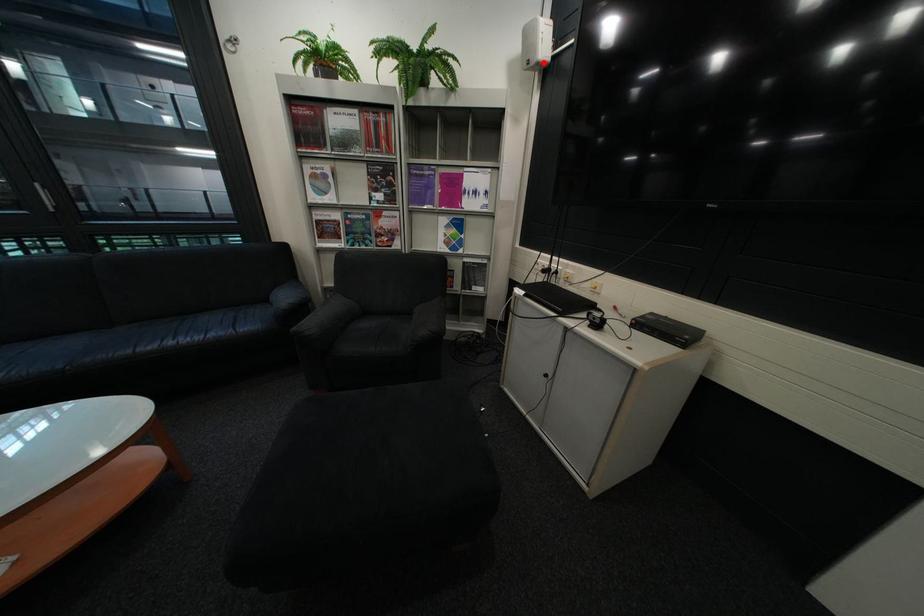
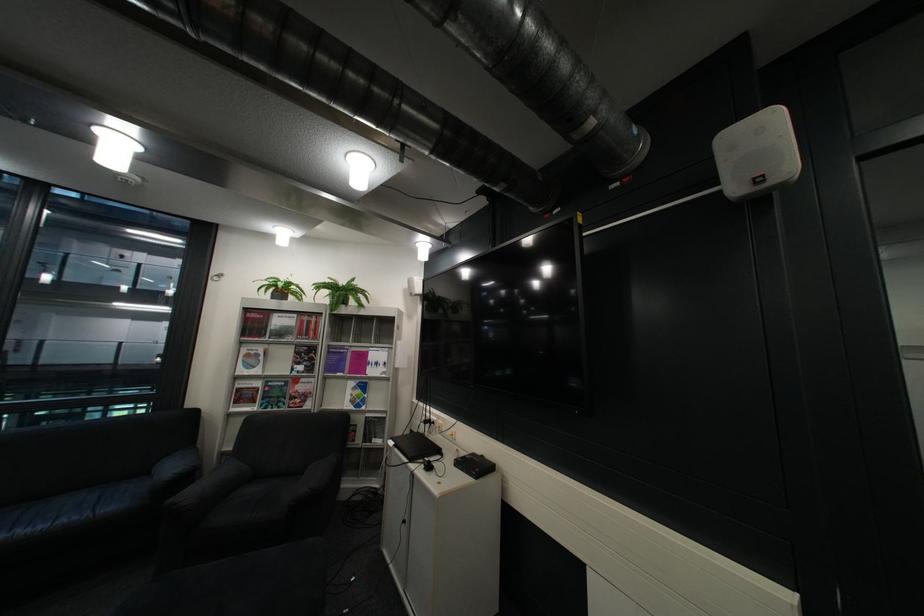
Question: I am providing you with two images of the same scene from different viewpoints. A red point is marked on the first image. Can you still see the location of the red point in image 2?

Choices:
 (A) Yes
 (B) No

Answer: (A)